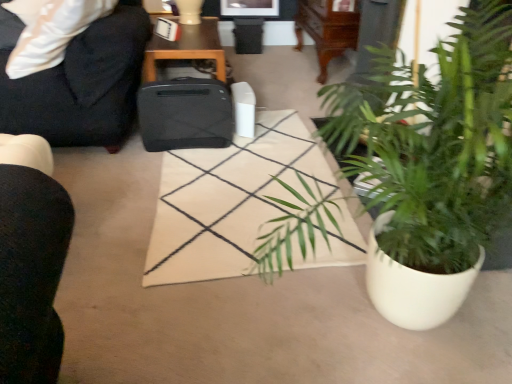
In order to face green leafy plant in white pot at lower right, should I rotate leftwards or rightwards?

Turn right approximately 19.679 degrees to face it.

What is the approximate width of black matte printer at center?

black matte printer at center is 87.50 centimeters wide.

What do you see at coordinates (187, 48) in the screenshot? Image resolution: width=512 pixels, height=384 pixels. I see `black wood table at upper center` at bounding box center [187, 48].

Measure the distance between black plastic trash can at center and camera.

3.65 meters.

The width and height of the screenshot is (512, 384). Find the location of `green leafy plant in white pot at lower right`. green leafy plant in white pot at lower right is located at coordinates (431, 164).

Based on the photo, would you say black fabric chair at upper left is part of black matte suitcase at center's contents?

Definitely not — black fabric chair at upper left is not inside black matte suitcase at center.

Is black matte suitcase at center placed right next to black fabric chair at upper left?

No, black matte suitcase at center is not with black fabric chair at upper left.

Does black matte suitcase at center have a greater height compared to black fabric chair at upper left?

No, black matte suitcase at center is not taller than black fabric chair at upper left.

Which object is closer to the camera, black matte suitcase at center or black fabric chair at upper left?

black fabric chair at upper left.

Looking at this image, considering the relative sizes of black matte suitcase at center and black plastic trash can at center in the image provided, is black matte suitcase at center bigger than black plastic trash can at center?

Yes, black matte suitcase at center is bigger than black plastic trash can at center.

Locate an element on the screen. trash bin/can behind the black matte suitcase at center is located at coordinates (248, 35).

Which object is further away from the camera, black matte suitcase at center or black plastic trash can at center?

black plastic trash can at center is more distant.

Does black matte suitcase at center have a greater width compared to black plastic trash can at center?

Incorrect, the width of black matte suitcase at center does not surpass that of black plastic trash can at center.

From the image's perspective, is black fabric chair at upper left above or below green leafy plant in white pot at lower right?

black fabric chair at upper left is above green leafy plant in white pot at lower right.

Image resolution: width=512 pixels, height=384 pixels. Find the location of `chair that appears behind the green leafy plant in white pot at lower right`. chair that appears behind the green leafy plant in white pot at lower right is located at coordinates (79, 83).

Can you tell me how much black fabric chair at upper left and green leafy plant in white pot at lower right differ in facing direction?

The angle between the facing direction of black fabric chair at upper left and the facing direction of green leafy plant in white pot at lower right is 14.8 degrees.

From a real-world perspective, is black fabric chair at upper left located higher than green leafy plant in white pot at lower right?

Correct, in the physical world, black fabric chair at upper left is higher than green leafy plant in white pot at lower right.

Based on the photo, considering the relative sizes of green leafy plant in white pot at lower right and black fabric chair at upper left in the image provided, is green leafy plant in white pot at lower right smaller than black fabric chair at upper left?

Incorrect, green leafy plant in white pot at lower right is not smaller in size than black fabric chair at upper left.

Is black fabric chair at upper left at the back of green leafy plant in white pot at lower right?

No, green leafy plant in white pot at lower right's orientation is not away from black fabric chair at upper left.

What's the angular difference between green leafy plant in white pot at lower right and black fabric chair at upper left's facing directions?

There is a 14.8-degree angle between the facing directions of green leafy plant in white pot at lower right and black fabric chair at upper left.

Which object is further away from the camera, green leafy plant in white pot at lower right or black fabric chair at upper left?

black fabric chair at upper left is further away from the camera.

Can you tell me how much black matte suitcase at center and black matte printer at center differ in facing direction?

There is a 87.5-degree angle between the facing directions of black matte suitcase at center and black matte printer at center.

Which object is positioned more to the left, black matte suitcase at center or black matte printer at center?

black matte suitcase at center.

Is black matte suitcase at center not inside black matte printer at center?

Yes, black matte suitcase at center is not within black matte printer at center.

From a real-world perspective, between black matte suitcase at center and black matte printer at center, who is vertically higher?

black matte suitcase at center is physically above.

Does green leafy plant in white pot at lower right touch black wood table at upper center?

They are not placed beside each other.

From the image's perspective, is green leafy plant in white pot at lower right over black wood table at upper center?

Actually, green leafy plant in white pot at lower right appears below black wood table at upper center in the image.

Considering the points (317, 218) and (147, 76), which point is in front, point (317, 218) or point (147, 76)?

Point (317, 218)

Looking at their sizes, would you say green leafy plant in white pot at lower right is wider or thinner than black matte printer at center?

Clearly, green leafy plant in white pot at lower right has more width compared to black matte printer at center.

Looking at this image, which object is positioned more to the left, green leafy plant in white pot at lower right or black matte printer at center?

black matte printer at center.

From a real-world perspective, between green leafy plant in white pot at lower right and black matte printer at center, who is vertically higher?

green leafy plant in white pot at lower right, from a real-world perspective.

You are a GUI agent. You are given a task and a screenshot of the screen. Output one action in this format:
    pyautogui.click(x=<x>, y=<y>)
    Task: Click on the chair that appears in front of the black matte suitcase at center
    
    Given the screenshot: What is the action you would take?
    pyautogui.click(x=79, y=83)

This screenshot has width=512, height=384. Find the location of `trash bin/can behind the black matte suitcase at center`. trash bin/can behind the black matte suitcase at center is located at coordinates (248, 35).

When comparing their distances from black plastic trash can at center, does black matte printer at center or green leafy plant in white pot at lower right seem closer?

black matte printer at center is closer to black plastic trash can at center.

Based on their spatial positions, is black wood table at upper center or black matte suitcase at center further from black matte printer at center?

black wood table at upper center lies further to black matte printer at center than the other object.

Based on their spatial positions, is black matte printer at center or black fabric chair at upper left closer to black matte suitcase at center?

black fabric chair at upper left.

Considering their positions, is black matte suitcase at center positioned closer to green leafy plant in white pot at lower right than black plastic trash can at center?

The object closer to green leafy plant in white pot at lower right is black matte suitcase at center.

Which object lies further to the anchor point green leafy plant in white pot at lower right, black matte printer at center or black plastic trash can at center?

black plastic trash can at center is positioned further to the anchor green leafy plant in white pot at lower right.

Which object lies further to the anchor point black plastic trash can at center, black wood table at upper center or black fabric chair at upper left?

black fabric chair at upper left lies further to black plastic trash can at center than the other object.

When comparing their distances from green leafy plant in white pot at lower right, does black fabric chair at upper left or black matte suitcase at center seem closer?

A: Based on the image, black matte suitcase at center appears to be nearer to green leafy plant in white pot at lower right.

Looking at the image, which one is located further to black plastic trash can at center, black matte printer at center or black matte suitcase at center?

Among the two, black matte printer at center is located further to black plastic trash can at center.

Locate an element on the screen. Image resolution: width=512 pixels, height=384 pixels. table between green leafy plant in white pot at lower right and black plastic trash can at center from front to back is located at coordinates [187, 48].

The height and width of the screenshot is (384, 512). What are the coordinates of `table located between black fabric chair at upper left and black plastic trash can at center in the depth direction` in the screenshot? It's located at pyautogui.click(x=187, y=48).

Where is `luggage positioned between black fabric chair at upper left and black plastic trash can at center from near to far`? This screenshot has width=512, height=384. luggage positioned between black fabric chair at upper left and black plastic trash can at center from near to far is located at coordinates (185, 114).

Identify the location of plain between black fabric chair at upper left and green leafy plant in white pot at lower right. click(x=241, y=205).